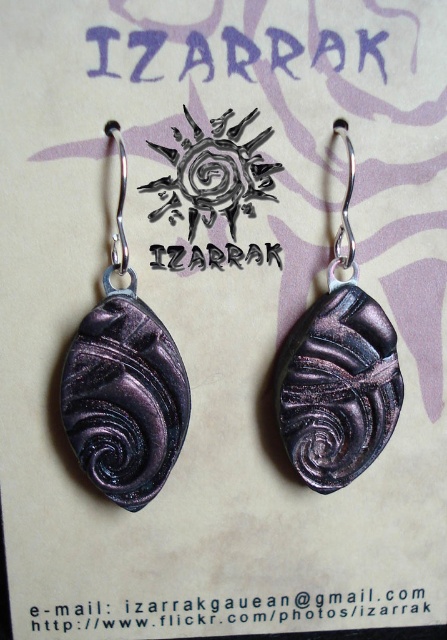
Question: Estimate the real-world distances between objects in this image. Which object is closer to the metallic purple swirls at center?

Choices:
 (A) purple metallic swirl at center
 (B) purple metallic swirls at left

Answer: (B)

Question: Which point is closer to the camera?

Choices:
 (A) (216, 204)
 (B) (177, 419)
 (C) (358, 288)

Answer: (A)

Question: Is purple metallic swirls at left wider than metallic purple swirls at center?

Choices:
 (A) yes
 (B) no

Answer: (B)

Question: Can you confirm if metallic purple swirls at center is bigger than purple metallic swirl at center?

Choices:
 (A) no
 (B) yes

Answer: (B)

Question: Which of these objects is positioned farthest from the purple metallic swirl at center?

Choices:
 (A) purple metallic swirls at left
 (B) metallic purple swirls at center

Answer: (B)

Question: Is metallic purple swirls at center to the right of purple metallic swirl at center from the viewer's perspective?

Choices:
 (A) no
 (B) yes

Answer: (B)